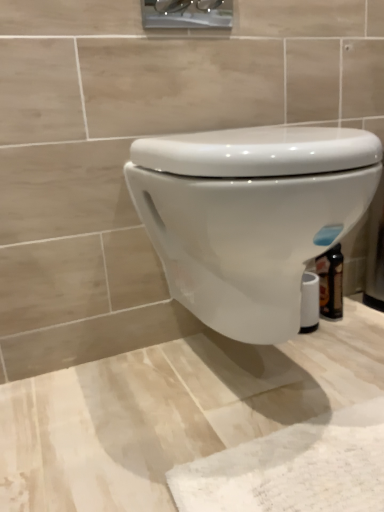
What do you see at coordinates (250, 216) in the screenshot? Image resolution: width=384 pixels, height=512 pixels. I see `white glossy toilet at center` at bounding box center [250, 216].

Find the location of `white glossy toilet at center`. white glossy toilet at center is located at coordinates (250, 216).

Identify the location of white glossy toilet at center. The image size is (384, 512). 250,216.